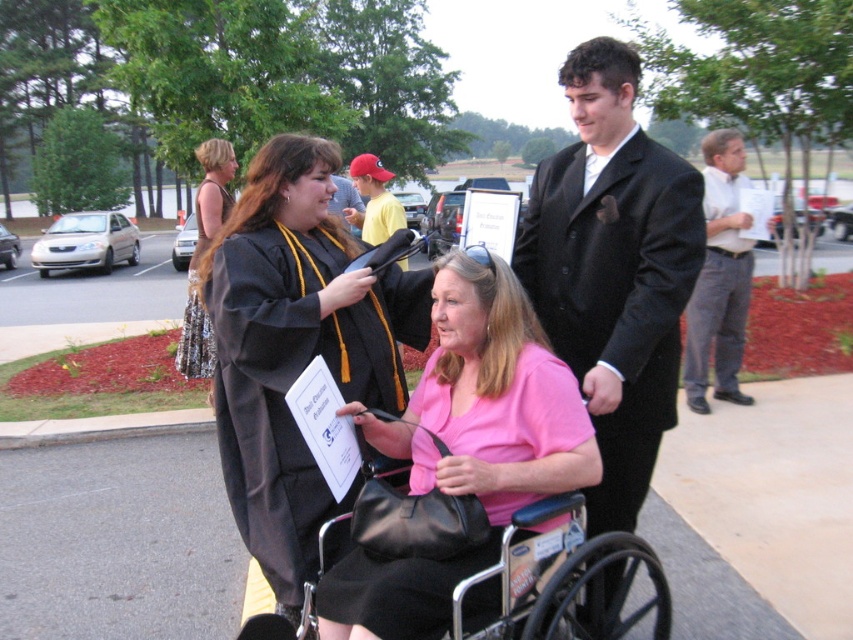
From the picture: You are attending a graduation ceremony and see the matte black graduation gown at center and the black wool suit at center. Which one is more to the left?

The matte black graduation gown at center is more to the left because it is positioned on the left side of the black wool suit at center.

You are standing at the graduation ceremony and want to know which of the two points, point (721, 314) or point (373, 188), is nearer to you. Can you determine this based on their positions?

Point (721, 314) is closer to the viewer than point (373, 188).

You are a photographer at the graduation ceremony. You need to capture a photo of both the matte black graduation gown at center and the black wool suit at center. Based on their positions, which one should you focus on first to ensure both are in frame?

The matte black graduation gown at center is below the black wool suit at center, so you should focus on the black wool suit at center first to ensure both are in frame.